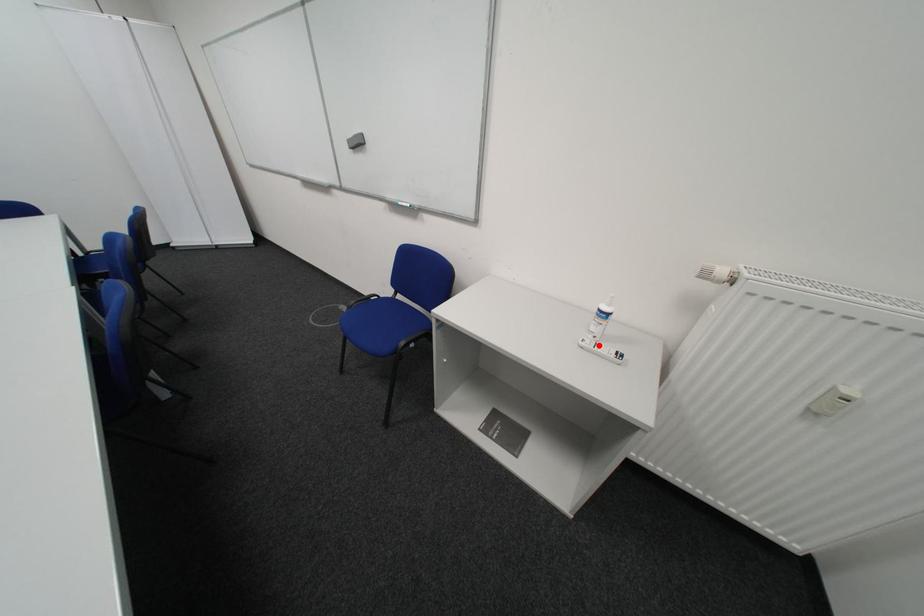
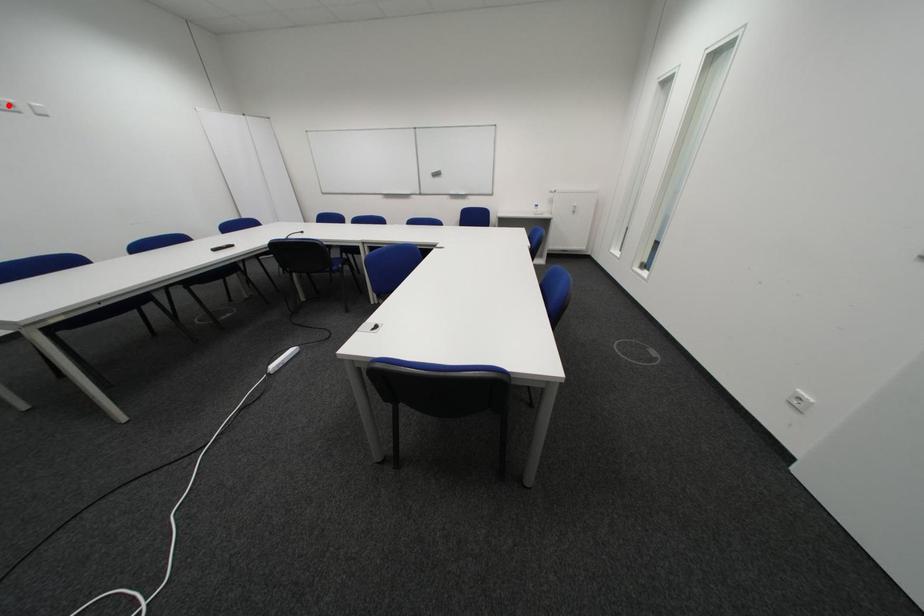
I am providing you with two images of the same scene from different viewpoints. A red point is marked on the first image and another point is marked on the second image. Is the marked point in image1 the same physical position as the marked point in image2?

No